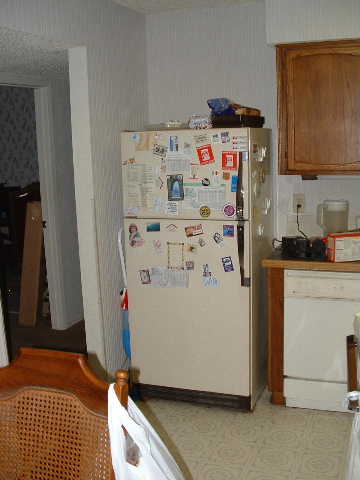
What are the coordinates of `electrical cable` in the screenshot? It's located at (297, 221).